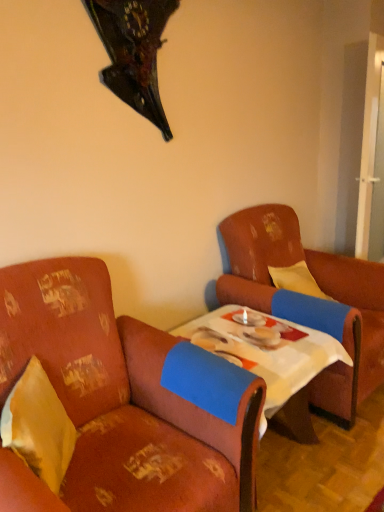
At what (x,y) coordinates should I click in order to perform the action: click on free spot above white cloth-covered table at center (from a real-world perspective). Please return your answer as a coordinate pair (x, y). This screenshot has width=384, height=512. Looking at the image, I should click on (245, 331).